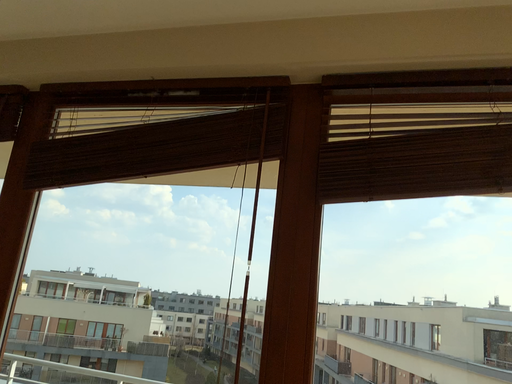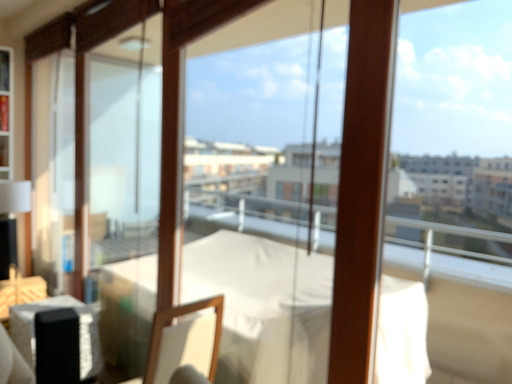
Question: Which way did the camera rotate in the video?

Choices:
 (A) rotated downward
 (B) rotated upward

Answer: (A)